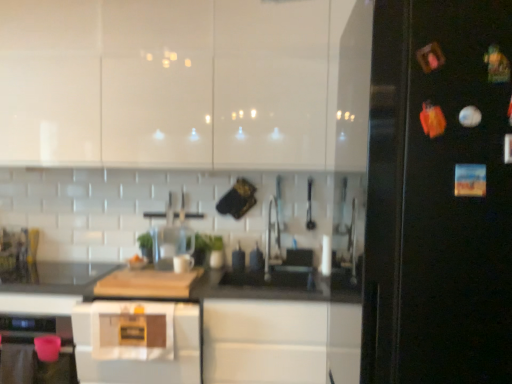
The height and width of the screenshot is (384, 512). Describe the element at coordinates (185, 83) in the screenshot. I see `white glossy cabinets at upper center` at that location.

The image size is (512, 384). Describe the element at coordinates (439, 194) in the screenshot. I see `black glossy fridge at right` at that location.

Where is `black matte countertop at center`? black matte countertop at center is located at coordinates (197, 335).

This screenshot has height=384, width=512. What do you see at coordinates (137, 342) in the screenshot? I see `white glossy microwave at center` at bounding box center [137, 342].

This screenshot has width=512, height=384. I want to click on white glossy microwave at center, so click(x=137, y=342).

I want to click on white glossy cabinets at upper center, so click(x=185, y=83).

From a real-world perspective, which object rests below the other?

In real-world perspective, black glossy fridge at right is lower.

Between white glossy cabinets at upper center and black glossy fridge at right, which one has more height?

Standing taller between the two is black glossy fridge at right.

Is white glossy cabinets at upper center far from black glossy fridge at right?

Yes, white glossy cabinets at upper center and black glossy fridge at right are quite far apart.

Which object is more forward, white glossy cabinets at upper center or black glossy fridge at right?

black glossy fridge at right is closer to the camera.

Is black glossy fridge at right oriented away from clear glass blender at center?

No, clear glass blender at center is not at the back of black glossy fridge at right.

Between point (409, 204) and point (174, 228), which one is positioned behind?

The point (174, 228) is more distant.

From a real-world perspective, is black glossy fridge at right under clear glass blender at center?

Incorrect, from a real-world perspective, black glossy fridge at right is higher than clear glass blender at center.

Is the position of clear glass blender at center less distant than that of black glossy fridge at right?

No, clear glass blender at center is behind black glossy fridge at right.

Is clear glass blender at center oriented towards black glossy fridge at right?

No, clear glass blender at center is not aimed at black glossy fridge at right.

Consider the image. From the image's perspective, between clear glass blender at center and black glossy fridge at right, who is located below?

From the image's view, clear glass blender at center is below.

Who is bigger, clear glass blender at center or black glossy fridge at right?

black glossy fridge at right is bigger.

Which object is further away from the camera taking this photo, clear glass blender at center or white glossy cabinets at upper center?

clear glass blender at center is further away from the camera.

Is clear glass blender at center oriented away from white glossy cabinets at upper center?

No, white glossy cabinets at upper center is not at the back of clear glass blender at center.

Considering the positions of objects clear glass blender at center and white glossy cabinets at upper center in the image provided, who is more to the right, clear glass blender at center or white glossy cabinets at upper center?

From the viewer's perspective, clear glass blender at center appears more on the right side.

Which is closer, (161, 246) or (0, 23)?

Clearly, point (161, 246) is more distant from the camera than point (0, 23).

Which object is positioned more to the left, black matte countertop at center or white glossy microwave at center?

white glossy microwave at center is more to the left.

Is point (303, 327) closer to camera compared to point (191, 327)?

No.

From the image's perspective, between black matte countertop at center and white glossy microwave at center, who is located below?

white glossy microwave at center is shown below in the image.

Is black matte countertop at center bigger or smaller than white glossy microwave at center?

black matte countertop at center is bigger than white glossy microwave at center.

In the scene shown: From a real-world perspective, who is located higher, white glossy microwave at center or black glossy fridge at right?

black glossy fridge at right.

Is white glossy microwave at center facing towards black glossy fridge at right?

No, white glossy microwave at center is not aimed at black glossy fridge at right.

What's the angular difference between white glossy microwave at center and black glossy fridge at right's facing directions?

white glossy microwave at center and black glossy fridge at right are facing 91.1 degrees away from each other.

From the picture: Can you confirm if white glossy microwave at center is bigger than black glossy fridge at right?

Actually, white glossy microwave at center might be smaller than black glossy fridge at right.

I want to click on countertop below the white glossy cabinets at upper center (from the image's perspective), so 197,335.

Which is behind, black matte countertop at center or white glossy cabinets at upper center?

white glossy cabinets at upper center.

From the image's perspective, which object appears higher, black matte countertop at center or white glossy cabinets at upper center?

white glossy cabinets at upper center, from the image's perspective.

You are a GUI agent. You are given a task and a screenshot of the screen. Output one action in this format:
    pyautogui.click(x=<x>, y=<y>)
    Task: Click on the fridge below the white glossy cabinets at upper center (from a real-world perspective)
    The image size is (512, 384).
    Given the screenshot: What is the action you would take?
    pyautogui.click(x=439, y=194)

The width and height of the screenshot is (512, 384). I want to click on fridge above the clear glass blender at center (from the image's perspective), so click(x=439, y=194).

Looking at the image, which one is located closer to white glossy microwave at center, white glossy cabinets at upper center or black matte countertop at center?

black matte countertop at center.

From the picture: When comparing their distances from black glossy fridge at right, does clear glass blender at center or white glossy microwave at center seem further?

clear glass blender at center lies further to black glossy fridge at right than the other object.

When comparing their distances from white glossy cabinets at upper center, does clear glass blender at center or black matte countertop at center seem further?

The object further to white glossy cabinets at upper center is black matte countertop at center.

Looking at the image, which one is located further to black matte countertop at center, black glossy fridge at right or white glossy cabinets at upper center?

Among the two, black glossy fridge at right is located further to black matte countertop at center.

Consider the image. Looking at the image, which one is located further to white glossy cabinets at upper center, black matte countertop at center or white glossy microwave at center?

The object further to white glossy cabinets at upper center is white glossy microwave at center.

Looking at the image, which one is located further to black matte countertop at center, white glossy cabinets at upper center or clear glass blender at center?

white glossy cabinets at upper center lies further to black matte countertop at center than the other object.

Looking at the image, which one is located further to black matte countertop at center, clear glass blender at center or white glossy microwave at center?

Among the two, clear glass blender at center is located further to black matte countertop at center.

Which object lies nearer to the anchor point clear glass blender at center, black glossy fridge at right or black matte countertop at center?

The object closer to clear glass blender at center is black matte countertop at center.

Find the location of `fridge between white glossy cabinets at upper center and white glossy microwave at center in the vertical direction`. fridge between white glossy cabinets at upper center and white glossy microwave at center in the vertical direction is located at coordinates (439, 194).

Image resolution: width=512 pixels, height=384 pixels. I want to click on home appliance located between black glossy fridge at right and clear glass blender at center in the depth direction, so click(137, 342).

Locate an element on the screen. This screenshot has height=384, width=512. fridge between white glossy cabinets at upper center and black matte countertop at center in the vertical direction is located at coordinates (439, 194).

Find the location of a particular element. countertop between white glossy cabinets at upper center and white glossy microwave at center in the up-down direction is located at coordinates (197, 335).